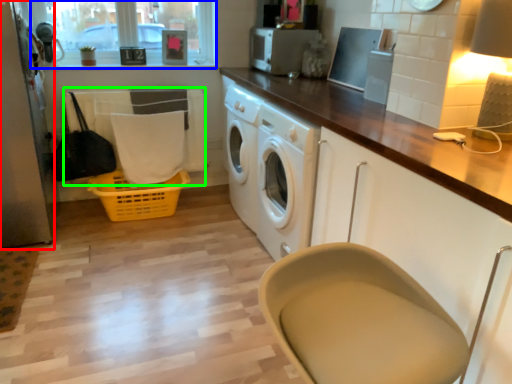
Question: Based on their relative distances, which object is nearer to screen door (highlighted by a red box)? Choose from window screen (highlighted by a blue box) and laundry (highlighted by a green box).

Choices:
 (A) window screen
 (B) laundry

Answer: (B)